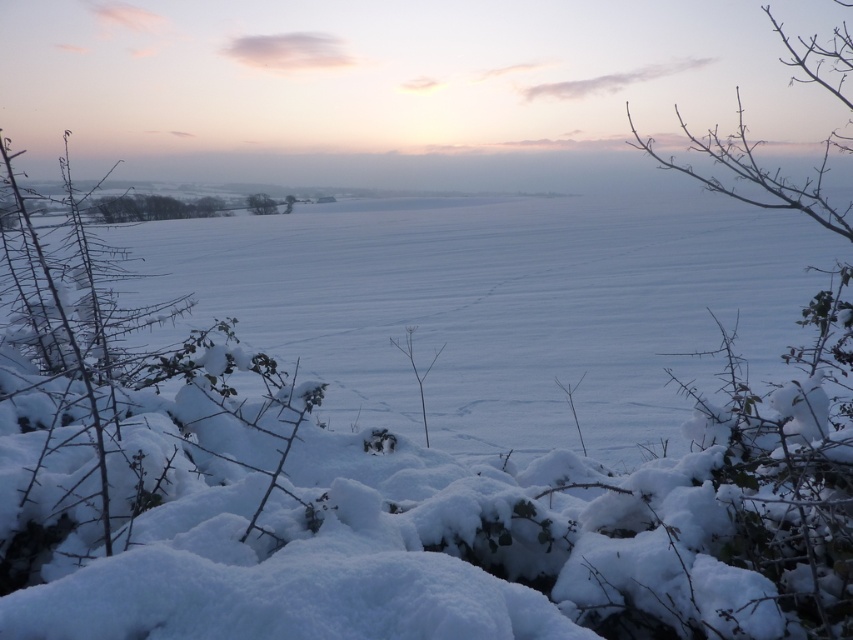
At what (x,y) coordinates should I click in order to perform the action: click on snow-covered thorny bush at left. Please return your answer as a coordinate pair (x, y). The height and width of the screenshot is (640, 853). Looking at the image, I should click on (119, 401).

Consider the image. Which is more to the left, snow-covered thorny bush at left or green leafy trees at upper left?

green leafy trees at upper left is more to the left.

The width and height of the screenshot is (853, 640). What are the coordinates of `snow-covered thorny bush at left` in the screenshot? It's located at (119, 401).

Locate an element on the screen. snow-covered thorny bush at left is located at coordinates (119, 401).

Between snow-covered thorny bush at left and green leafy tree at center, which one has more height?

snow-covered thorny bush at left is taller.

Does snow-covered thorny bush at left appear on the right side of green leafy tree at center?

Incorrect, snow-covered thorny bush at left is not on the right side of green leafy tree at center.

Does point (90, 401) lie behind point (257, 205)?

No, (90, 401) is in front of (257, 205).

Find the location of a particular element. snow-covered thorny bush at left is located at coordinates (119, 401).

Between green leafy trees at upper left and green leafy tree at center, which one is positioned higher?

green leafy tree at center

Which is more to the right, green leafy trees at upper left or green leafy tree at center?

From the viewer's perspective, green leafy tree at center appears more on the right side.

What do you see at coordinates (154, 208) in the screenshot?
I see `green leafy trees at upper left` at bounding box center [154, 208].

What are the coordinates of `green leafy trees at upper left` in the screenshot? It's located at (154, 208).